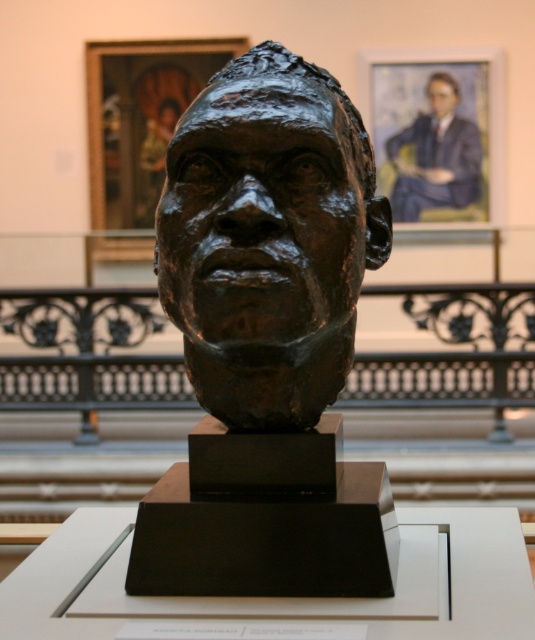
Between bronze head at center and blue suit at upper right, which one appears on the right side from the viewer's perspective?

blue suit at upper right is more to the right.

Image resolution: width=535 pixels, height=640 pixels. In order to click on bronze head at center in this screenshot , I will do `click(266, 340)`.

In order to click on bronze head at center in this screenshot , I will do `click(266, 340)`.

Is bronze head at center behind matte bronze bust at upper center?

No, it is not.

In the scene shown: Is bronze head at center to the left of matte bronze bust at upper center from the viewer's perspective?

Indeed, bronze head at center is positioned on the left side of matte bronze bust at upper center.

Between point (248, 262) and point (450, 86), which one is positioned behind?

The point (450, 86) is more distant.

Locate an element on the screen. bronze head at center is located at coordinates (266, 340).

Does point (460, 99) come farther from viewer compared to point (448, 109)?

No, (460, 99) is in front of (448, 109).

Is blue suit at upper right to the right of matte bronze bust at upper center from the viewer's perspective?

In fact, blue suit at upper right is to the left of matte bronze bust at upper center.

Locate an element on the screen. blue suit at upper right is located at coordinates 435,156.